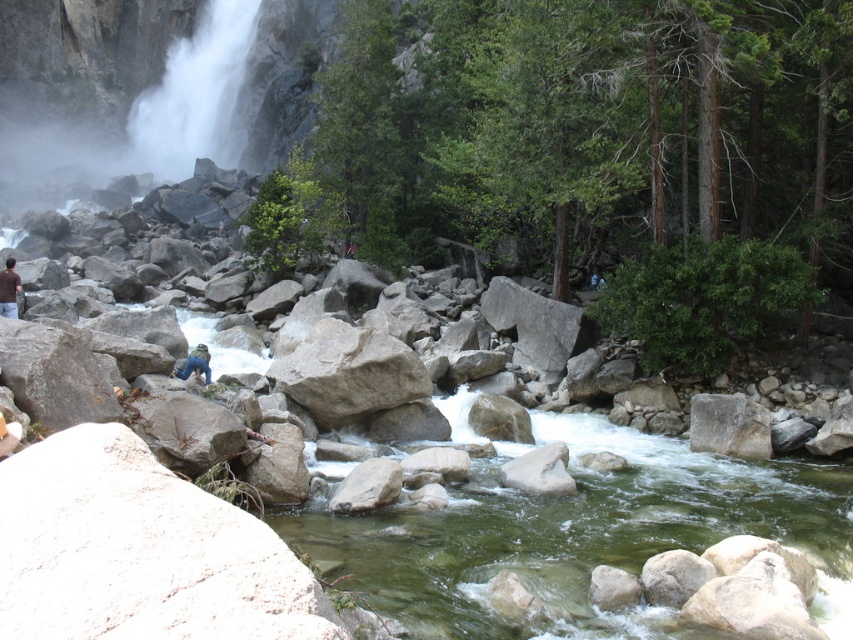
Does clear stone stream at center have a greater height compared to blue fabric pants at center?

Indeed, clear stone stream at center has a greater height compared to blue fabric pants at center.

Does clear stone stream at center lie in front of blue fabric pants at center?

Yes, clear stone stream at center is in front of blue fabric pants at center.

This screenshot has width=853, height=640. What do you see at coordinates (581, 532) in the screenshot? I see `clear stone stream at center` at bounding box center [581, 532].

At what (x,y) coordinates should I click in order to perform the action: click on clear stone stream at center. Please return your answer as a coordinate pair (x, y). The width and height of the screenshot is (853, 640). Looking at the image, I should click on (581, 532).

Which is more to the left, brown fabric shirt at lower left or blue fabric pants at center?

Positioned to the left is brown fabric shirt at lower left.

Can you confirm if brown fabric shirt at lower left is taller than blue fabric pants at center?

Correct, brown fabric shirt at lower left is much taller as blue fabric pants at center.

What are the coordinates of `brown fabric shirt at lower left` in the screenshot? It's located at (9, 289).

The height and width of the screenshot is (640, 853). Identify the location of brown fabric shirt at lower left. (9, 289).

Can you confirm if clear stone stream at center is thinner than brown fabric shirt at lower left?

Indeed, clear stone stream at center has a lesser width compared to brown fabric shirt at lower left.

I want to click on clear stone stream at center, so click(x=581, y=532).